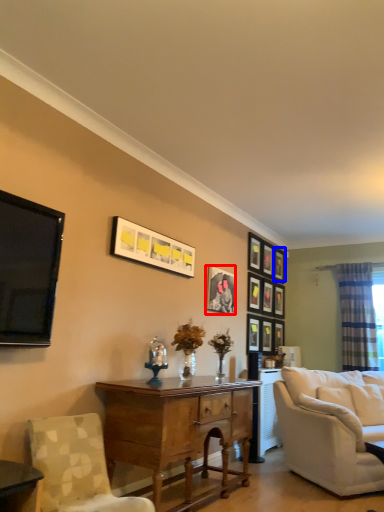
Question: Which of the following is the farthest to the observer, picture frame (highlighted by a red box) or picture frame (highlighted by a blue box)?

Choices:
 (A) picture frame
 (B) picture frame

Answer: (B)